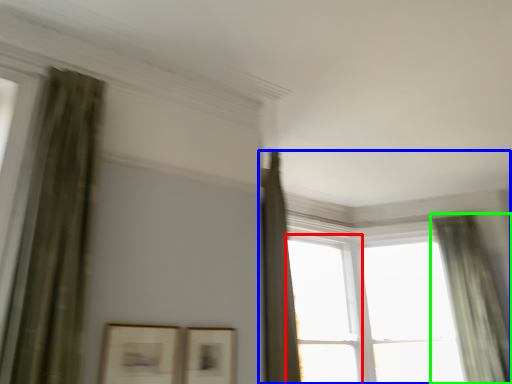
Question: Which object is positioned closest to window (highlighted by a red box)? Select from window (highlighted by a blue box) and curtain (highlighted by a green box).

Choices:
 (A) window
 (B) curtain

Answer: (B)